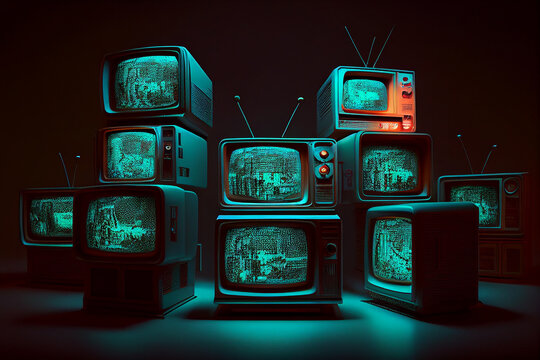
Where is `rendering of televisions with green pictures`? The image size is (540, 360). rendering of televisions with green pictures is located at coordinates [52, 214], [125, 220], [130, 142], [140, 72], [268, 170], [252, 259], [391, 252], [391, 156], [372, 90], [487, 192].